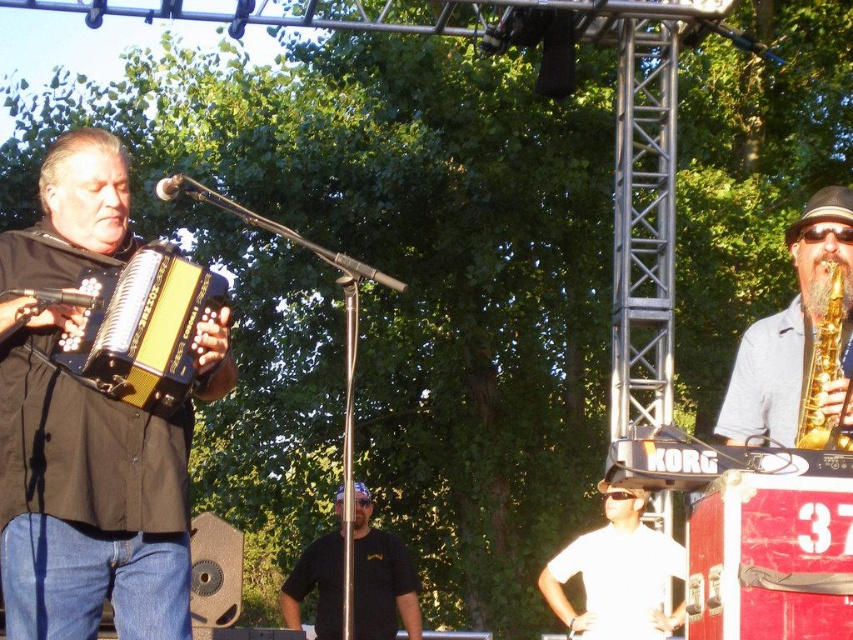
Does gold shiny saxophone at upper right have a greater height compared to gold metallic saxophone at right?

Correct, gold shiny saxophone at upper right is much taller as gold metallic saxophone at right.

Can you confirm if gold shiny saxophone at upper right is wider than gold metallic saxophone at right?

Yes.

Measure the distance between point (781, 440) and camera.

A distance of 10.44 meters exists between point (781, 440) and camera.

Where is `gold shiny saxophone at upper right`? gold shiny saxophone at upper right is located at coordinates (792, 330).

Between point (35, 502) and point (828, 385), which one is positioned behind?

Point (35, 502)

Image resolution: width=853 pixels, height=640 pixels. What do you see at coordinates (83, 433) in the screenshot?
I see `black matte accordion at left` at bounding box center [83, 433].

What do you see at coordinates (83, 433) in the screenshot? This screenshot has height=640, width=853. I see `black matte accordion at left` at bounding box center [83, 433].

Where is `black matte accordion at left`? black matte accordion at left is located at coordinates (83, 433).

Consider the image. Does gold shiny saxophone at upper right have a greater height compared to white matte shirt at center?

Correct, gold shiny saxophone at upper right is much taller as white matte shirt at center.

Who is positioned more to the right, gold shiny saxophone at upper right or white matte shirt at center?

From the viewer's perspective, gold shiny saxophone at upper right appears more on the right side.

The image size is (853, 640). I want to click on gold shiny saxophone at upper right, so click(x=792, y=330).